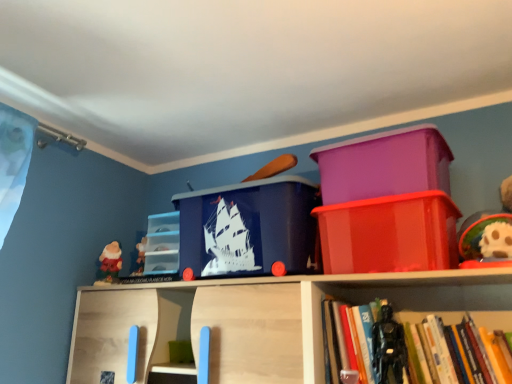
Question: From a real-world perspective, is blue plastic storage box at center, which is the third storage box from right to left, beneath glossy plastic container at upper right, the fourth storage box in the left-to-right sequence?

Choices:
 (A) no
 (B) yes

Answer: (A)

Question: From the image's perspective, is blue plastic storage box at center, arranged as the 2th storage box when viewed from the left, beneath glossy plastic container at upper right, which is counted as the 1th storage box, starting from the right?

Choices:
 (A) yes
 (B) no

Answer: (B)

Question: Can you confirm if blue plastic storage box at center, arranged as the 2th storage box when viewed from the left, is shorter than glossy plastic container at upper right, the fourth storage box in the left-to-right sequence?

Choices:
 (A) yes
 (B) no

Answer: (B)

Question: Does blue plastic storage box at center, which is the third storage box from right to left, contain glossy plastic container at upper right, the fourth storage box in the left-to-right sequence?

Choices:
 (A) yes
 (B) no

Answer: (B)

Question: Considering the relative sizes of blue plastic storage box at center, which is the third storage box from right to left, and glossy plastic container at upper right, the fourth storage box in the left-to-right sequence, in the image provided, is blue plastic storage box at center, which is the third storage box from right to left, smaller than glossy plastic container at upper right, the fourth storage box in the left-to-right sequence,?

Choices:
 (A) yes
 (B) no

Answer: (B)

Question: Are blue plastic storage box at center, arranged as the 2th storage box when viewed from the left, and glossy plastic container at upper right, which is counted as the 1th storage box, starting from the right, far apart?

Choices:
 (A) yes
 (B) no

Answer: (B)

Question: Could you tell me if blue plastic storage box at center, arranged as the 2th storage box when viewed from the left, is turned towards transparent plastic storage box at center, which is the first storage box from left to right?

Choices:
 (A) yes
 (B) no

Answer: (B)

Question: Considering the relative sizes of blue plastic storage box at center, which is the third storage box from right to left, and transparent plastic storage box at center, which is the first storage box from left to right, in the image provided, is blue plastic storage box at center, which is the third storage box from right to left, smaller than transparent plastic storage box at center, which is the first storage box from left to right,?

Choices:
 (A) yes
 (B) no

Answer: (B)

Question: From a real-world perspective, does blue plastic storage box at center, which is the third storage box from right to left, sit lower than transparent plastic storage box at center, which is the first storage box from left to right?

Choices:
 (A) no
 (B) yes

Answer: (A)

Question: From a real-world perspective, is blue plastic storage box at center, which is the third storage box from right to left, positioned over transparent plastic storage box at center, which ranks as the fourth storage box in right-to-left order, based on gravity?

Choices:
 (A) yes
 (B) no

Answer: (A)

Question: Is blue plastic storage box at center, which is the third storage box from right to left, to the left of transparent plastic storage box at center, which is the first storage box from left to right, from the viewer's perspective?

Choices:
 (A) yes
 (B) no

Answer: (B)

Question: Is blue plastic storage box at center, arranged as the 2th storage box when viewed from the left, taller than transparent plastic storage box at center, which is the first storage box from left to right?

Choices:
 (A) no
 (B) yes

Answer: (B)

Question: From the image's perspective, is red velvet santa at left, which ranks as the second toy in front-to-back order, beneath hardcover book at lower right?

Choices:
 (A) yes
 (B) no

Answer: (B)